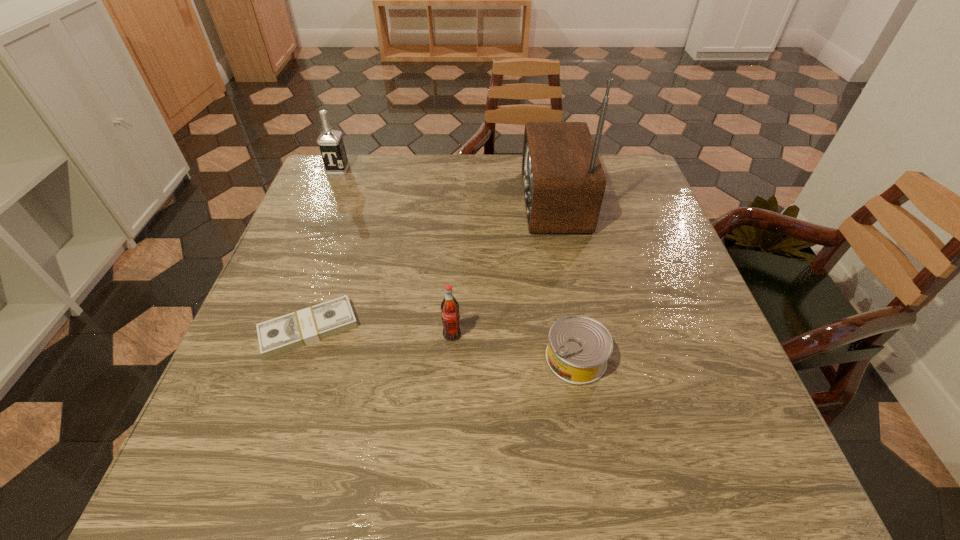
Find the location of a particular element. Image resolution: width=960 pixels, height=540 pixels. radio receiver is located at coordinates (563, 180).

Locate an element on the screen. the fourth shortest object is located at coordinates (330, 141).

You are a GUI agent. You are given a task and a screenshot of the screen. Output one action in this format:
    pyautogui.click(x=<x>, y=<y>)
    Task: Click on the third shortest object
    The image size is (960, 540).
    Given the screenshot: What is the action you would take?
    pyautogui.click(x=450, y=315)

This screenshot has height=540, width=960. What are the coordinates of `soda bottle` in the screenshot? It's located at (450, 315).

Where is `can`? The height and width of the screenshot is (540, 960). can is located at coordinates (579, 347).

Image resolution: width=960 pixels, height=540 pixels. In order to click on the shortest object in this screenshot , I will do `click(282, 334)`.

At what (x,y) coordinates should I click in order to perform the action: click on free point located 0.060m on the front-facing side of the radio receiver. Please return your answer as a coordinate pair (x, y). This screenshot has width=960, height=540. Looking at the image, I should click on (497, 201).

Find the location of a particular element. This screenshot has height=540, width=960. free space located on the front-facing side of the radio receiver is located at coordinates (390, 201).

The height and width of the screenshot is (540, 960). Identify the location of vacant area situated 0.130m on the front-facing side of the radio receiver. (471, 201).

At what (x,y) coordinates should I click in order to perform the action: click on vacant space located 0.160m on the front label of the vodka. Please return your answer as a coordinate pair (x, y). Looking at the image, I should click on (323, 210).